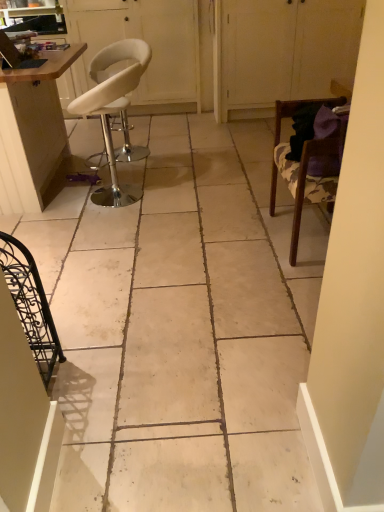
This screenshot has width=384, height=512. Find the location of `vacant space that is to the left of white leather stool at left, the 2th chair from the right`. vacant space that is to the left of white leather stool at left, the 2th chair from the right is located at coordinates (63, 205).